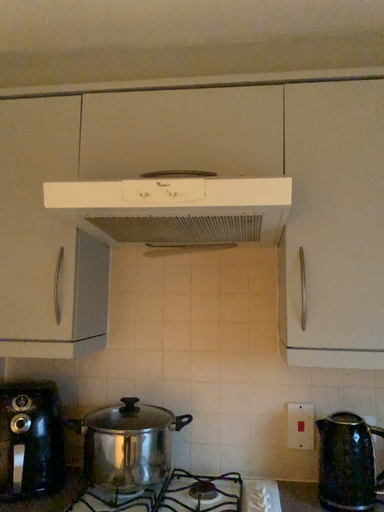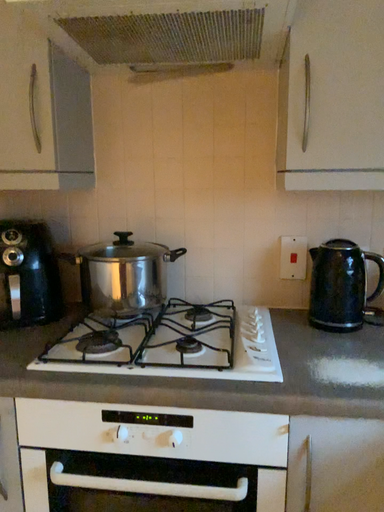
Question: How did the camera likely rotate when shooting the video?

Choices:
 (A) rotated upward
 (B) rotated downward

Answer: (B)